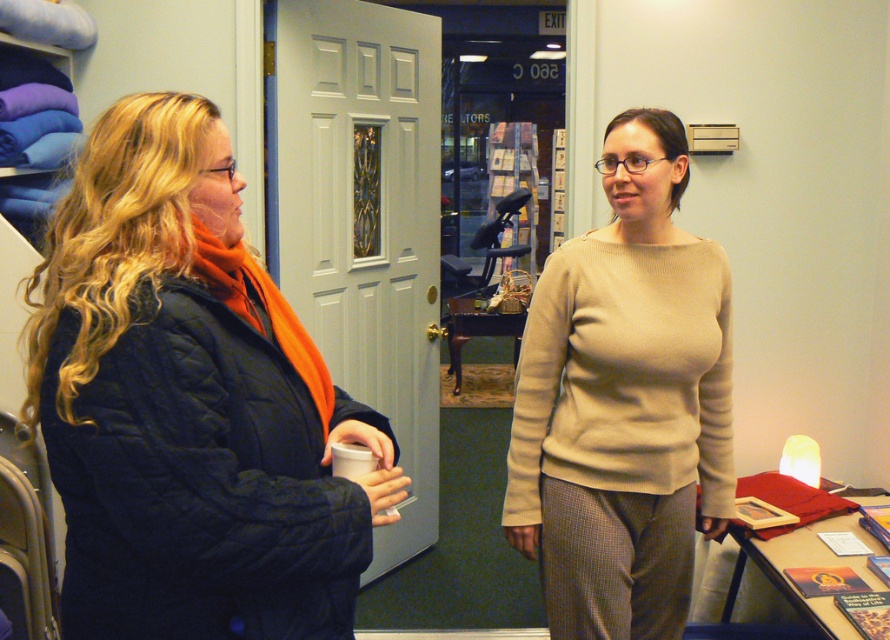
Question: Which of the following is the farthest from the observer?

Choices:
 (A) 518,397
 (B) 309,484

Answer: (A)

Question: Which point is closer to the camera taking this photo?

Choices:
 (A) (576, 621)
 (B) (282, 406)

Answer: (B)

Question: Is matte black coat at left below beige sweater at center?

Choices:
 (A) no
 (B) yes

Answer: (A)

Question: Which of the following is the farthest from the observer?

Choices:
 (A) (209, 557)
 (B) (658, 209)

Answer: (B)

Question: Is matte black coat at left positioned before beige sweater at center?

Choices:
 (A) no
 (B) yes

Answer: (B)

Question: Does matte black coat at left appear under beige sweater at center?

Choices:
 (A) yes
 (B) no

Answer: (B)